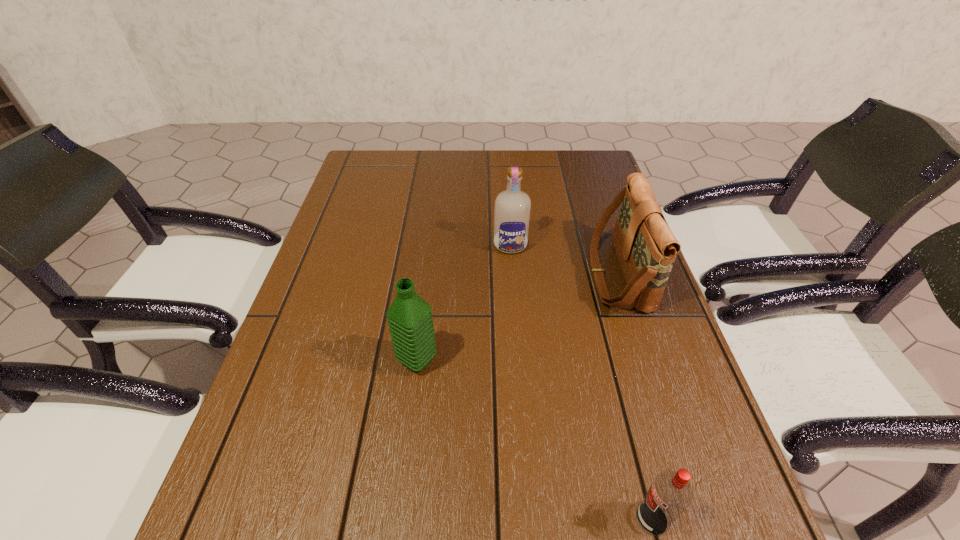
The height and width of the screenshot is (540, 960). Find the location of `vacant space at the near edge`. vacant space at the near edge is located at coordinates (356, 538).

Where is `vacant area at the left edge`? The width and height of the screenshot is (960, 540). vacant area at the left edge is located at coordinates tap(306, 306).

You are a GUI agent. You are given a task and a screenshot of the screen. Output one action in this format:
    pyautogui.click(x=<x>, y=<y>)
    Task: Click on the free space at the far left corner of the desktop
    The image size is (960, 540).
    Given the screenshot: What is the action you would take?
    pyautogui.click(x=381, y=152)

Identify the location of free space between the second object from left to right and the leftmost object. (464, 303).

This screenshot has height=540, width=960. Identify the location of free area in between the shoulder bag and the farther vodka. (564, 260).

Locate an element on the screen. Image resolution: width=960 pixels, height=540 pixels. unoccupied area between the left vodka and the nearest object is located at coordinates (581, 382).

Identify the location of vacant space that is in between the second object from left to right and the shoulder bag. (564, 260).

You are a GUI agent. You are given a task and a screenshot of the screen. Output one action in this format:
    pyautogui.click(x=<x>, y=<y>)
    Task: Click on the free spot between the left vodka and the shoulder bag
    Image resolution: width=960 pixels, height=540 pixels.
    Given the screenshot: What is the action you would take?
    pyautogui.click(x=564, y=260)

In order to click on free space between the shoulder bag and the taller vodka in this screenshot , I will do `click(564, 260)`.

Find the location of a particular element. This screenshot has width=960, height=540. vacant space that is in between the third farthest object and the left vodka is located at coordinates (464, 303).